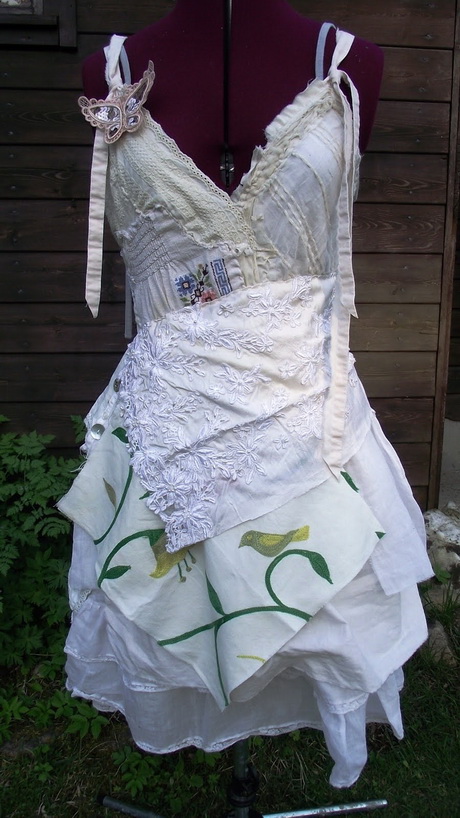
Image resolution: width=460 pixels, height=818 pixels. Identify the location of window frame. [x=35, y=21].